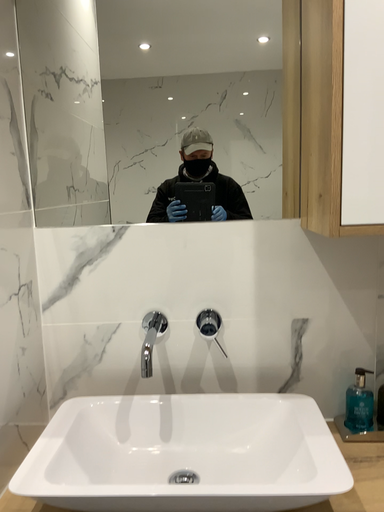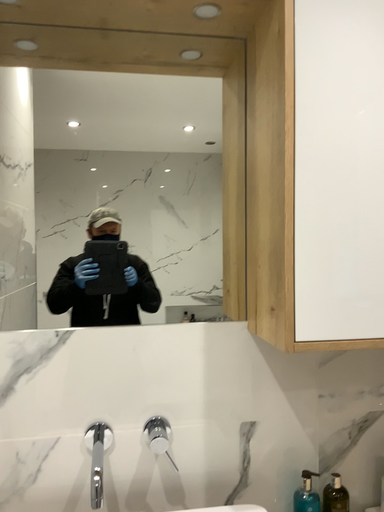
Question: How did the camera likely rotate when shooting the video?

Choices:
 (A) rotated downward
 (B) rotated upward

Answer: (B)